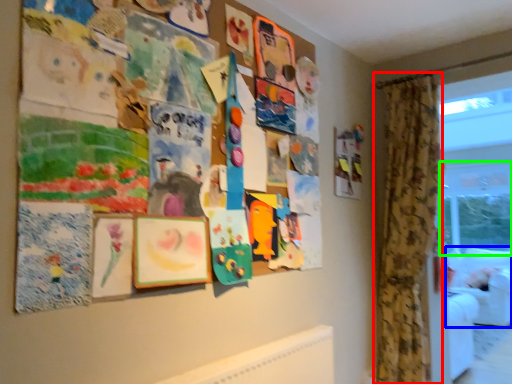
Question: Considering the real-world distances, which object is closest to curtain (highlighted by a red box)? couch (highlighted by a blue box) or window screen (highlighted by a green box).

Choices:
 (A) couch
 (B) window screen

Answer: (A)